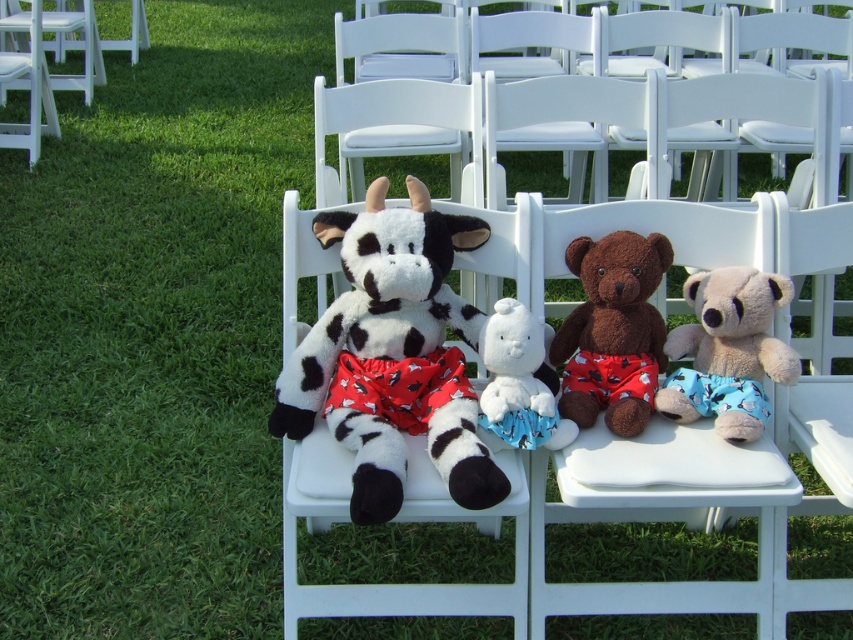
Does white plush rabbit at center appear over white wood chair at left?

No.

Does white plush rabbit at center appear on the right side of white wood chair at left?

Indeed, white plush rabbit at center is positioned on the right side of white wood chair at left.

The width and height of the screenshot is (853, 640). What do you see at coordinates (518, 384) in the screenshot? I see `white plush rabbit at center` at bounding box center [518, 384].

Identify the location of white plush rabbit at center. (518, 384).

Is soft plush cow at center thinner than white plush rabbit at center?

No.

Which of these two, soft plush cow at center or white plush rabbit at center, stands shorter?

white plush rabbit at center

This screenshot has width=853, height=640. I want to click on soft plush cow at center, so click(x=378, y=330).

Can you confirm if fluffy blue teddy bear at center right is wider than white wood chair at left?

No.

Can you confirm if fluffy blue teddy bear at center right is positioned below white wood chair at left?

Yes.

Who is more distant from viewer, (776,348) or (71,17)?

The point (71,17) is more distant.

The image size is (853, 640). What are the coordinates of `fluffy blue teddy bear at center right` in the screenshot? It's located at (729, 348).